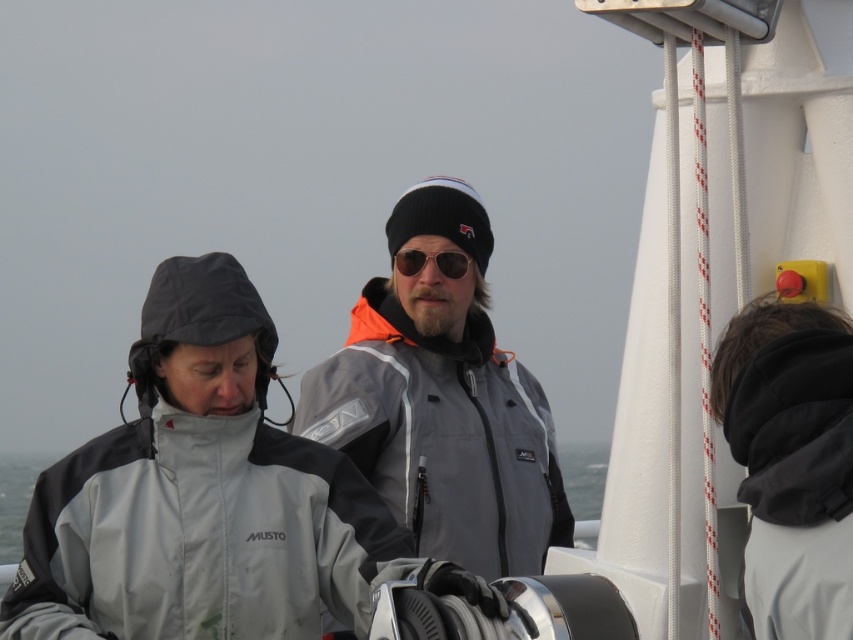
Consider the image. You are standing on the deck of a boat and want to reach a point marked at coordinates point (489, 433). If your vision can only clearly see objects within 50 meters, will you be able to see this point clearly?

The point (489, 433) is 54.32 meters away from the viewer, which is beyond the 50 meter range your vision can clearly see. Therefore, you won

You are on a boat and need to determine the order of the jackets. Which jacket is closer to you, the gray softshell jacket at center or the gray matte jacket at center?

The gray softshell jacket at center is closer to you because it is in front of the gray matte jacket at center.